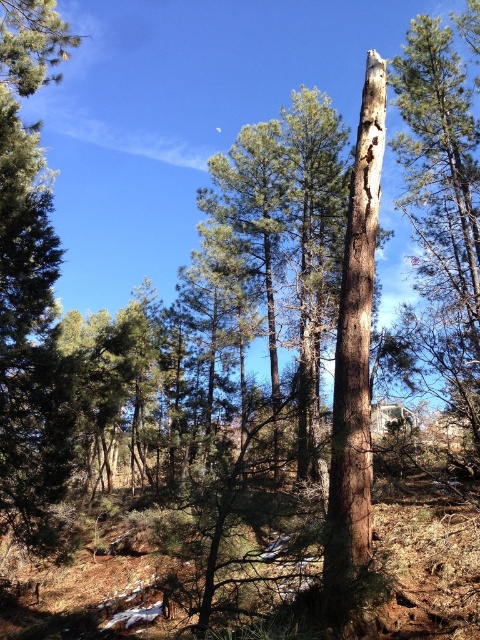
You are a hiker trying to identify two tree trunks in the forest. You see the smooth brown tree trunk at center and the brown rough tree trunk at center. Which one is bigger in size?

The smooth brown tree trunk at center is larger in size than the brown rough tree trunk at center.

You are a hiker trying to identify two distinct tree trunks in the forest. The smooth brown tree trunk at center and the brown rough tree trunk at center are both visible. Which of these two trunks has a greater width?

The smooth brown tree trunk at center has a greater width than the brown rough tree trunk at center.